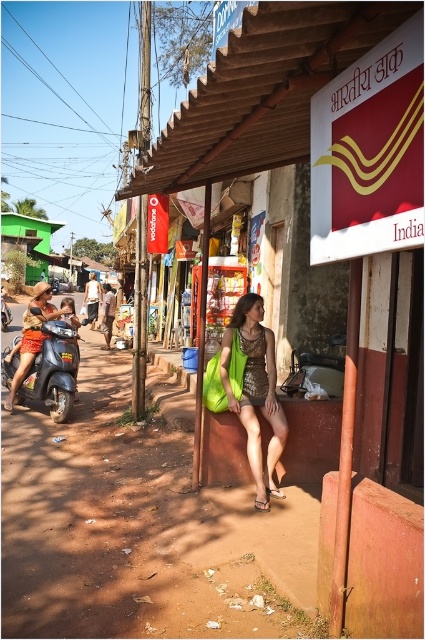
You are a traveler passing by the red fabric sign at upper center and the brown woven bag at center in the street scene. Which object takes up more space in the image?

The brown woven bag at center occupies more space than the red fabric sign at upper center.

You are a traveler who just arrived at this Indian village and need to decide which bag to take with you. You see a matte green bag at center and a brown woven bag at center. Which bag is shorter in height?

The matte green bag at center is shorter than the brown woven bag at center, so you should choose the matte green bag at center if you prefer a shorter bag.

You are standing at the point labeled point (107, 284) and want to walk to the point labeled point (376, 588). Which direction should you move to reach your destination?

You should move forward because point (376, 588) is in front of point (107, 284).